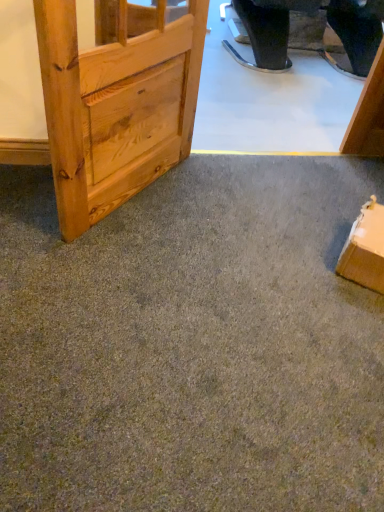
Image resolution: width=384 pixels, height=512 pixels. Describe the element at coordinates (116, 102) in the screenshot. I see `natural wood door at left` at that location.

I want to click on natural wood door at left, so click(116, 102).

The height and width of the screenshot is (512, 384). In order to click on natural wood door at left in this screenshot , I will do point(116,102).